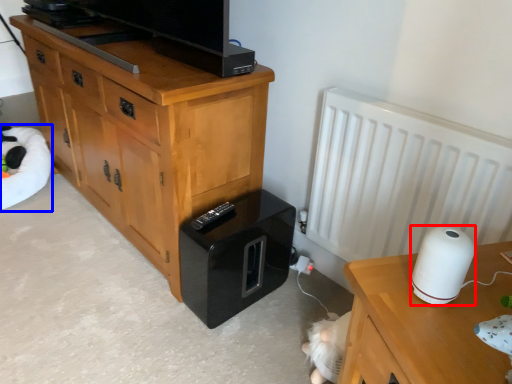
Question: Among these objects, which one is nearest to the camera, appliance (highlighted by a red box) or bean bag chair (highlighted by a blue box)?

Choices:
 (A) appliance
 (B) bean bag chair

Answer: (A)